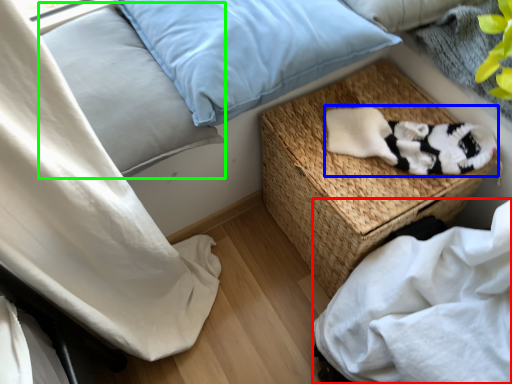
Question: Considering the real-world distances, which object is closest to sheet (highlighted by a red box)? material (highlighted by a blue box) or pillow (highlighted by a green box).

Choices:
 (A) material
 (B) pillow

Answer: (A)